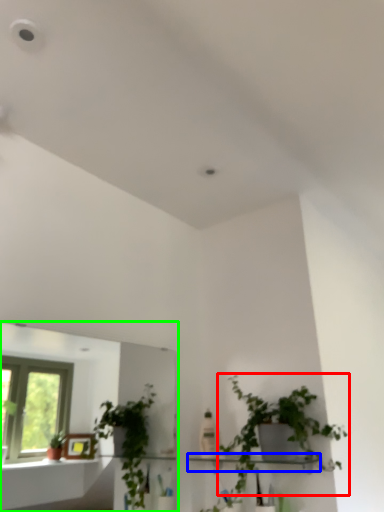
Question: Which object is positioned closest to houseplant (highlighted by a red box)? Select from shelf (highlighted by a blue box) and mirror (highlighted by a green box).

Choices:
 (A) shelf
 (B) mirror

Answer: (A)